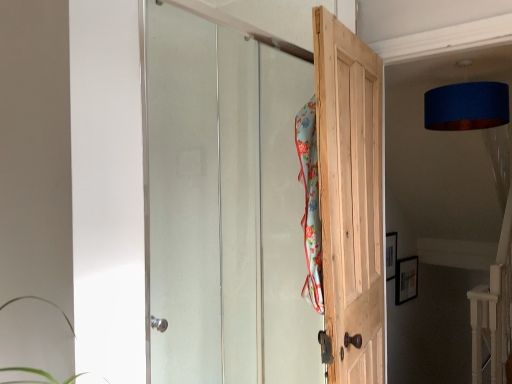
Question: Is clear glass door at upper center, arranged as the first door when viewed from the left, oriented away from natural wood door at center, which appears as the 2th door when viewed from the left?

Choices:
 (A) no
 (B) yes

Answer: (A)

Question: From the image's perspective, would you say clear glass door at upper center, arranged as the first door when viewed from the left, is positioned over natural wood door at center, which appears as the 2th door when viewed from the left?

Choices:
 (A) no
 (B) yes

Answer: (B)

Question: Is the position of clear glass door at upper center, the second door when ordered from right to left, more distant than that of natural wood door at center, arranged as the first door when viewed from the right?

Choices:
 (A) no
 (B) yes

Answer: (A)

Question: Are clear glass door at upper center, the second door when ordered from right to left, and natural wood door at center, which appears as the 2th door when viewed from the left, making contact?

Choices:
 (A) no
 (B) yes

Answer: (A)

Question: Is clear glass door at upper center, arranged as the first door when viewed from the left, not near natural wood door at center, arranged as the first door when viewed from the right?

Choices:
 (A) yes
 (B) no

Answer: (B)

Question: From the image's perspective, is floral fabric beach towel at center located above or below clear glass door at upper center, the second door when ordered from right to left?

Choices:
 (A) above
 (B) below

Answer: (A)

Question: Is point (303, 175) closer or farther from the camera than point (163, 337)?

Choices:
 (A) closer
 (B) farther

Answer: (A)

Question: Would you say floral fabric beach towel at center is inside or outside clear glass door at upper center, arranged as the first door when viewed from the left?

Choices:
 (A) outside
 (B) inside

Answer: (A)

Question: Considering the relative positions of floral fabric beach towel at center and clear glass door at upper center, the second door when ordered from right to left, in the image provided, is floral fabric beach towel at center to the left or to the right of clear glass door at upper center, the second door when ordered from right to left,?

Choices:
 (A) left
 (B) right

Answer: (B)

Question: Based on their positions, is clear glass door at upper center, the second door when ordered from right to left, located to the left or right of blue fabric lampshade at upper right?

Choices:
 (A) right
 (B) left

Answer: (B)

Question: Considering the positions of point (218, 299) and point (496, 87), is point (218, 299) closer or farther from the camera than point (496, 87)?

Choices:
 (A) closer
 (B) farther

Answer: (A)

Question: Based on their sizes in the image, would you say clear glass door at upper center, the second door when ordered from right to left, is bigger or smaller than blue fabric lampshade at upper right?

Choices:
 (A) big
 (B) small

Answer: (B)

Question: Considering the positions of clear glass door at upper center, the second door when ordered from right to left, and blue fabric lampshade at upper right in the image, is clear glass door at upper center, the second door when ordered from right to left, wider or thinner than blue fabric lampshade at upper right?

Choices:
 (A) wide
 (B) thin

Answer: (B)

Question: From a real-world perspective, is blue fabric lampshade at upper right physically located above or below floral fabric beach towel at center?

Choices:
 (A) above
 (B) below

Answer: (A)

Question: Would you say blue fabric lampshade at upper right is inside or outside floral fabric beach towel at center?

Choices:
 (A) inside
 (B) outside

Answer: (B)